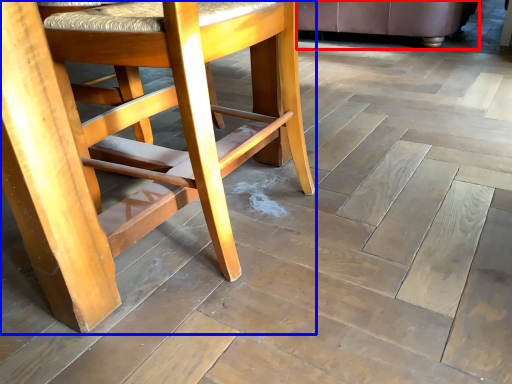
Question: Which object appears farthest to the camera in this image, chair (highlighted by a red box) or chair (highlighted by a blue box)?

Choices:
 (A) chair
 (B) chair

Answer: (A)